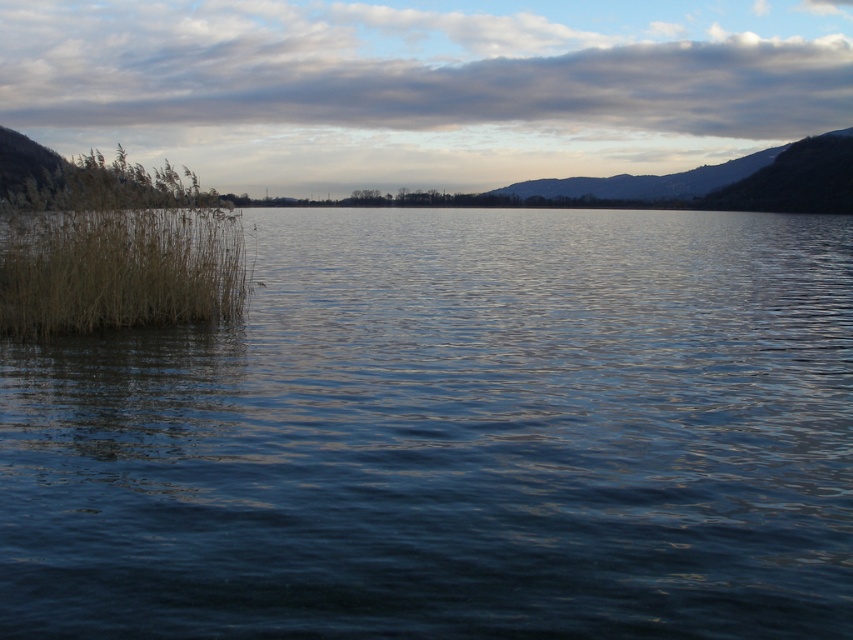
Question: Does brown grass at left appear on the right side of dark brown rocky mountain at upper right?

Choices:
 (A) yes
 (B) no

Answer: (B)

Question: Which of these objects is positioned farthest from the brown grass at left?

Choices:
 (A) dark brown rocky mountain at upper right
 (B) dark blue water at left

Answer: (A)

Question: Can you confirm if dark blue water at left is wider than brown grass at left?

Choices:
 (A) no
 (B) yes

Answer: (A)

Question: Which object appears farthest from the camera in this image?

Choices:
 (A) brown grass at left
 (B) dark brown rocky mountain at upper right

Answer: (B)

Question: Considering the real-world distances, which object is farthest from the dark brown rocky mountain at upper right?

Choices:
 (A) brown grass at left
 (B) dark blue water at left

Answer: (B)

Question: Does dark blue water at left have a larger size compared to brown grass at left?

Choices:
 (A) no
 (B) yes

Answer: (A)